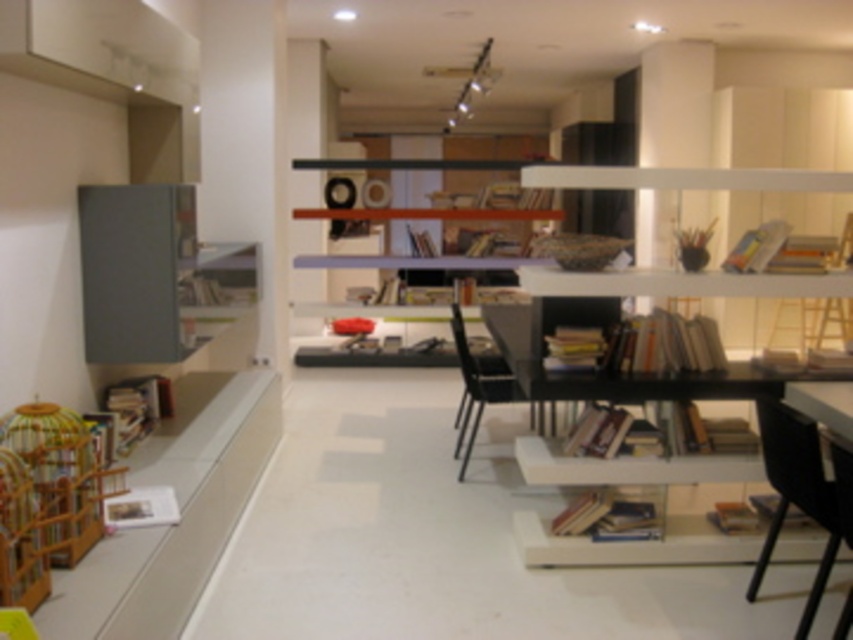
Question: Which of the following is the farthest from the observer?

Choices:
 (A) black plastic chair at lower right
 (B) white matte bookshelf at upper right
 (C) black glossy chair at center
 (D) matte gray cabinet at left

Answer: (C)

Question: Among these points, which one is nearest to the camera?

Choices:
 (A) (154, 337)
 (B) (550, 541)
 (C) (386, 168)
 (D) (456, 339)

Answer: (B)

Question: Is white matte bookshelf at upper right wider than matte gray cabinet at left?

Choices:
 (A) yes
 (B) no

Answer: (A)

Question: Considering the relative positions of black plastic chair at lower right and black glossy chair at center in the image provided, where is black plastic chair at lower right located with respect to black glossy chair at center?

Choices:
 (A) right
 (B) left

Answer: (A)

Question: Does white matte bookshelf at upper right have a greater width compared to black glossy chair at center?

Choices:
 (A) no
 (B) yes

Answer: (B)

Question: Which point is farther to the camera?

Choices:
 (A) matte gray cabinet at left
 (B) matte white bookshelf at center
 (C) black glossy chair at center

Answer: (B)